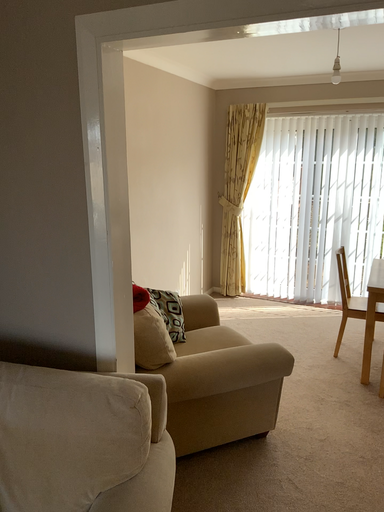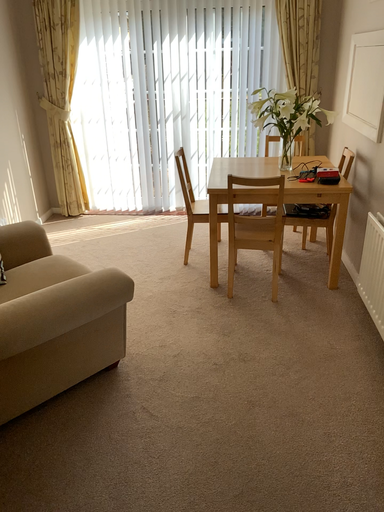
Question: Which way did the camera rotate in the video?

Choices:
 (A) rotated downward
 (B) rotated upward

Answer: (A)